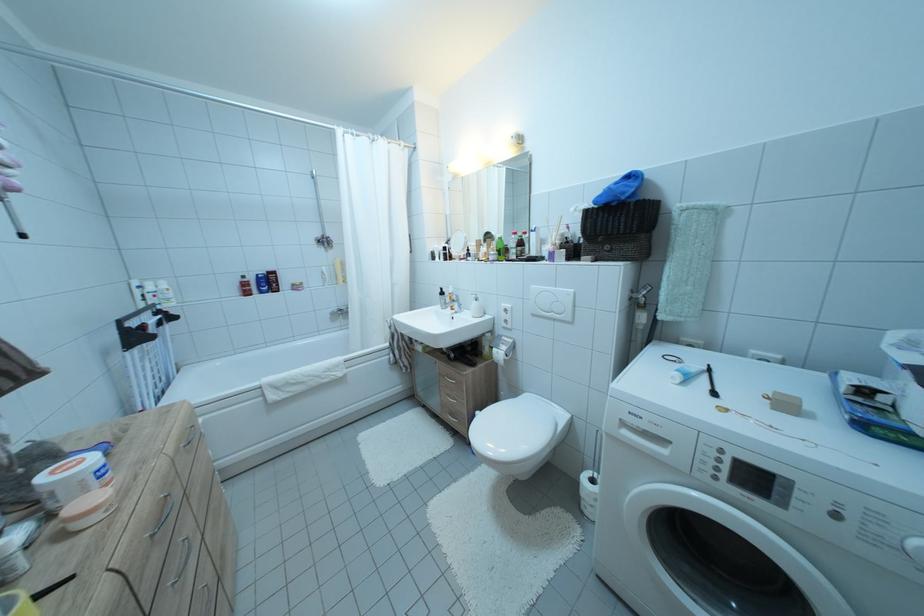
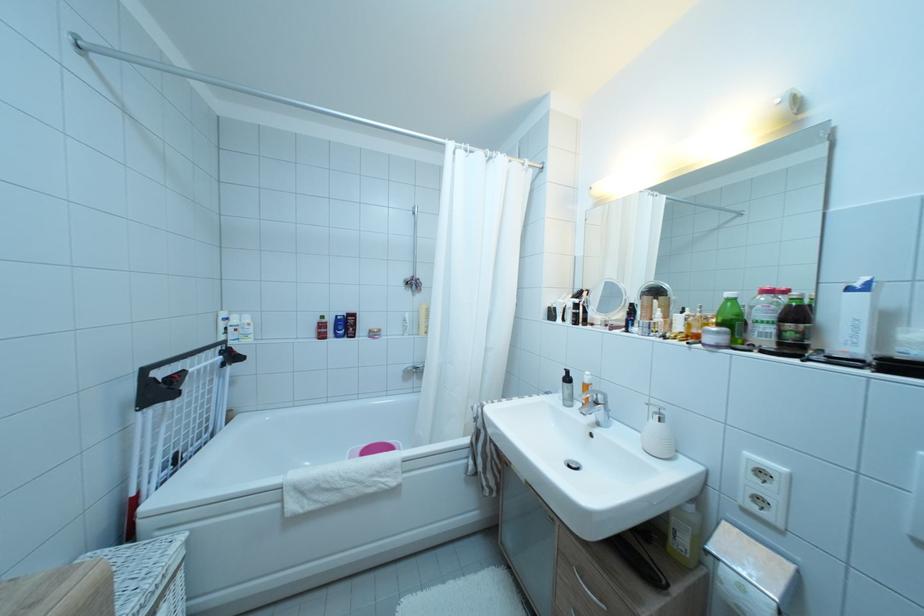
Where in the second image is the point corresponding to the point at 483,306 from the first image?

(667, 427)